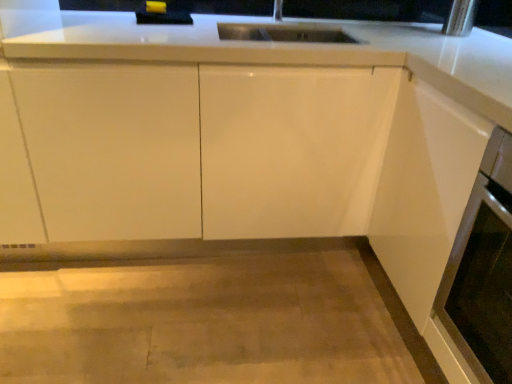
Question: In terms of size, does white glossy cabinet at center appear bigger or smaller than satin white oven at lower right?

Choices:
 (A) big
 (B) small

Answer: (A)

Question: Considering the positions of white glossy cabinet at center and satin white oven at lower right in the image, is white glossy cabinet at center wider or thinner than satin white oven at lower right?

Choices:
 (A) wide
 (B) thin

Answer: (A)

Question: From the image's perspective, is white glossy cabinet at center positioned above or below satin white oven at lower right?

Choices:
 (A) above
 (B) below

Answer: (A)

Question: In the image, is satin white oven at lower right positioned in front of or behind white glossy cabinet at center?

Choices:
 (A) behind
 (B) front

Answer: (B)

Question: Is point (500, 281) closer or farther from the camera than point (325, 165)?

Choices:
 (A) farther
 (B) closer

Answer: (B)

Question: In terms of height, does satin white oven at lower right look taller or shorter compared to white glossy cabinet at center?

Choices:
 (A) short
 (B) tall

Answer: (A)

Question: From the image's perspective, relative to white glossy cabinet at center, is satin white oven at lower right above or below?

Choices:
 (A) below
 (B) above

Answer: (A)